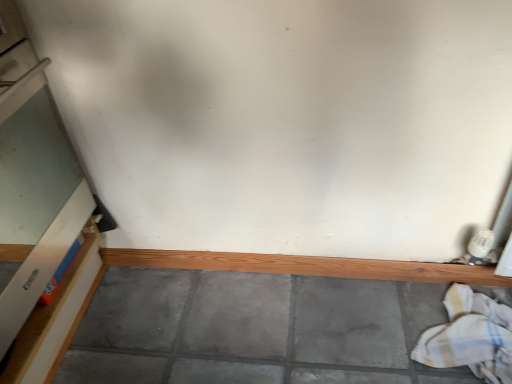
Question: Does white cotton laundry at lower right lie behind wooden at bottom?

Choices:
 (A) no
 (B) yes

Answer: (A)

Question: Can you confirm if white cotton laundry at lower right is thinner than wooden at bottom?

Choices:
 (A) no
 (B) yes

Answer: (A)

Question: Is white cotton laundry at lower right at the left side of wooden at bottom?

Choices:
 (A) no
 (B) yes

Answer: (A)

Question: Is white cotton laundry at lower right positioned beyond the bounds of wooden at bottom?

Choices:
 (A) yes
 (B) no

Answer: (A)

Question: Can you confirm if white cotton laundry at lower right is wider than wooden at bottom?

Choices:
 (A) yes
 (B) no

Answer: (A)

Question: From the image's perspective, would you say white cotton laundry at lower right is positioned over wooden at bottom?

Choices:
 (A) no
 (B) yes

Answer: (A)

Question: Is white cardboard box at left at the right side of wooden at bottom?

Choices:
 (A) yes
 (B) no

Answer: (B)

Question: Would you say white cardboard box at left contains wooden at bottom?

Choices:
 (A) yes
 (B) no

Answer: (B)

Question: Is white cardboard box at left bigger than wooden at bottom?

Choices:
 (A) yes
 (B) no

Answer: (A)

Question: Could you tell me if white cardboard box at left is facing wooden at bottom?

Choices:
 (A) no
 (B) yes

Answer: (A)

Question: Is white cardboard box at left located outside wooden at bottom?

Choices:
 (A) no
 (B) yes

Answer: (B)

Question: Is white cardboard box at left next to wooden at bottom and touching it?

Choices:
 (A) no
 (B) yes

Answer: (A)

Question: From the image's perspective, does wooden at bottom appear lower than white cotton laundry at lower right?

Choices:
 (A) yes
 (B) no

Answer: (B)